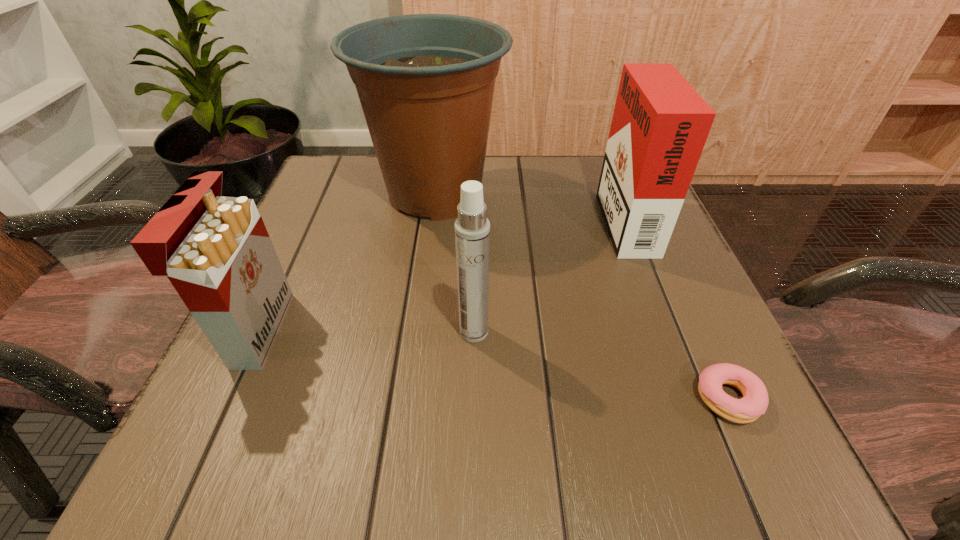
At what (x,y) coordinates should I click in order to perform the action: click on doughnut that is positioned at the right edge. Please return your answer as a coordinate pair (x, y). Looking at the image, I should click on (754, 403).

This screenshot has height=540, width=960. I want to click on object that is at the far left corner, so click(425, 82).

Identify the location of object located in the far right corner section of the desktop. The width and height of the screenshot is (960, 540). (660, 124).

In order to click on object at the near right corner in this screenshot , I will do `click(754, 403)`.

The width and height of the screenshot is (960, 540). What are the coordinates of `vacant area at the far edge` in the screenshot? It's located at (538, 197).

Locate an element on the screen. blank space at the near edge of the desktop is located at coordinates (539, 440).

Where is `free space at the left edge`? The height and width of the screenshot is (540, 960). free space at the left edge is located at coordinates (317, 225).

You are a GUI agent. You are given a task and a screenshot of the screen. Output one action in this format:
    pyautogui.click(x=<x>, y=<y>)
    Task: Click on the vacant space at the right edge of the desktop
    
    Given the screenshot: What is the action you would take?
    pyautogui.click(x=612, y=289)

You are a GUI agent. You are given a task and a screenshot of the screen. Output one action in this format:
    pyautogui.click(x=<x>, y=<y>)
    Task: Click on the free location at the far left corner
    This screenshot has width=960, height=540.
    Given the screenshot: What is the action you would take?
    pyautogui.click(x=366, y=179)

Identify the location of vacant area at the far right corner. (578, 156).